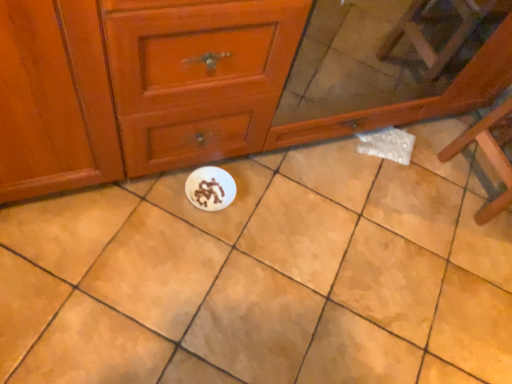
The height and width of the screenshot is (384, 512). In order to click on free region on the left part of wooden chair at right in this screenshot , I will do `click(421, 175)`.